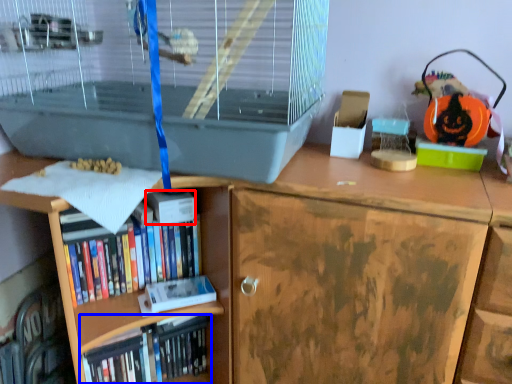
Question: Which object is further to the camera taking this photo, paperback book (highlighted by a red box) or book (highlighted by a blue box)?

Choices:
 (A) paperback book
 (B) book

Answer: (B)